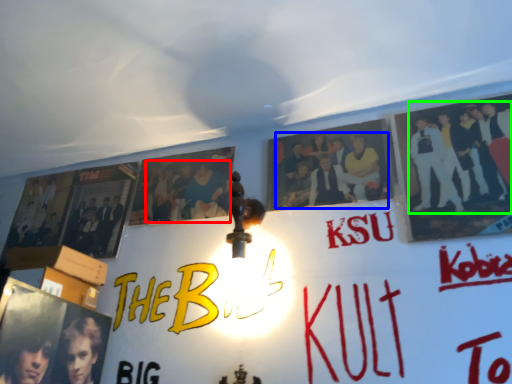
Question: Which is farther away from person (highlighted by a red box)? person (highlighted by a blue box) or person (highlighted by a green box)?

Choices:
 (A) person
 (B) person

Answer: (B)